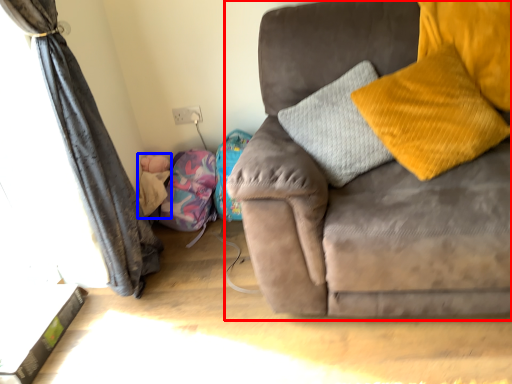
Question: Which of the following is the closest to the observer, studio couch (highlighted by a red box) or baby (highlighted by a blue box)?

Choices:
 (A) studio couch
 (B) baby

Answer: (A)